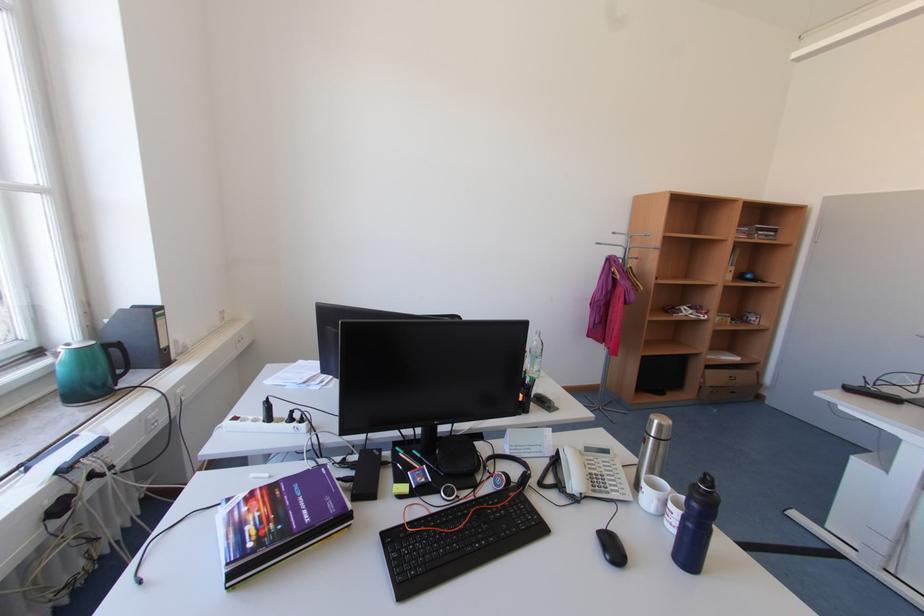
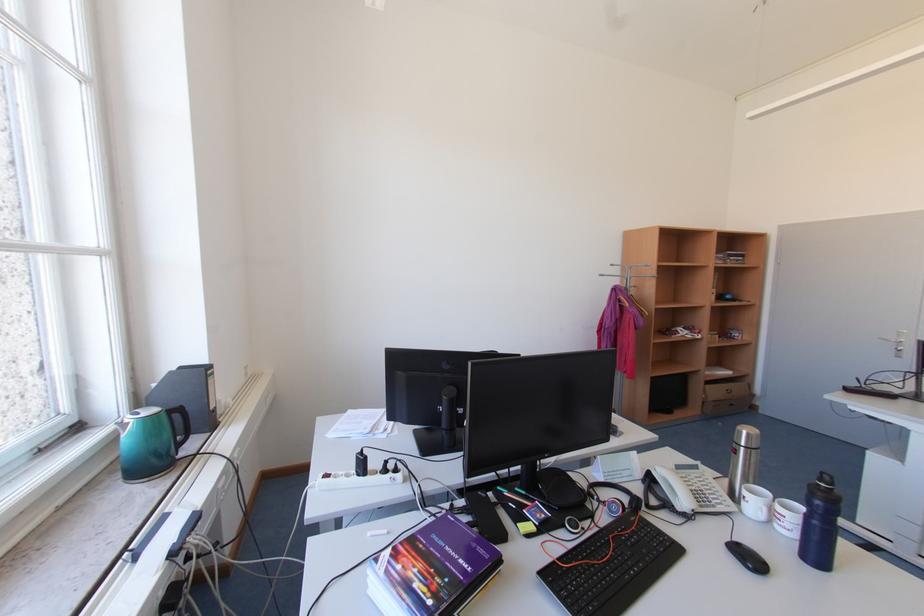
Locate, in the second image, the point that corresponds to point (650, 509) in the first image.

(757, 519)